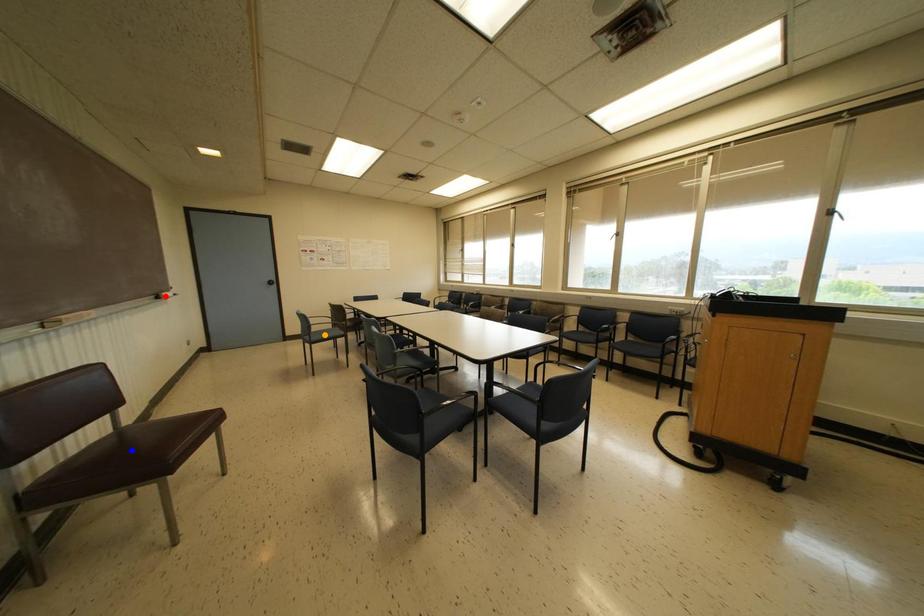
Order these from farthest to nearest:
- red point
- orange point
- blue point

orange point
red point
blue point